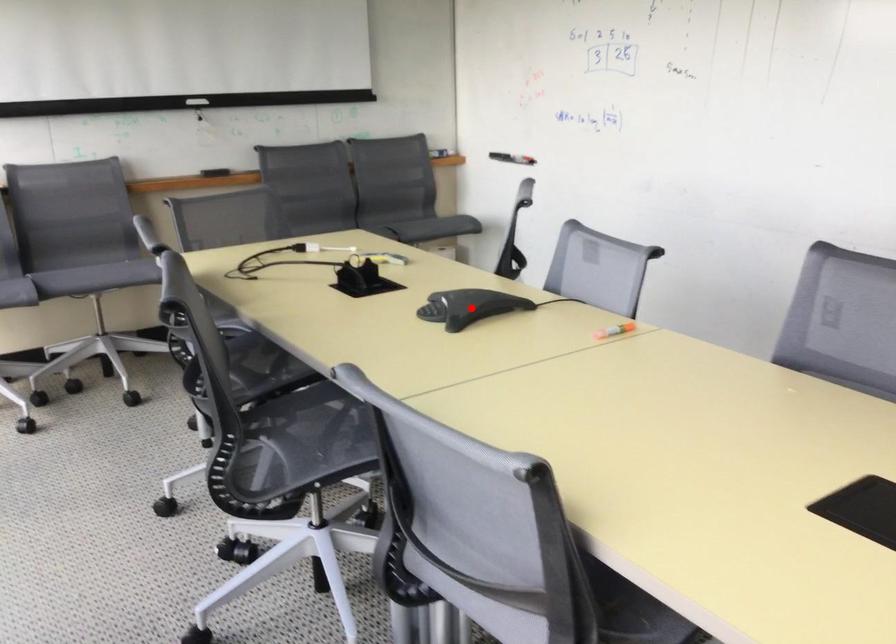
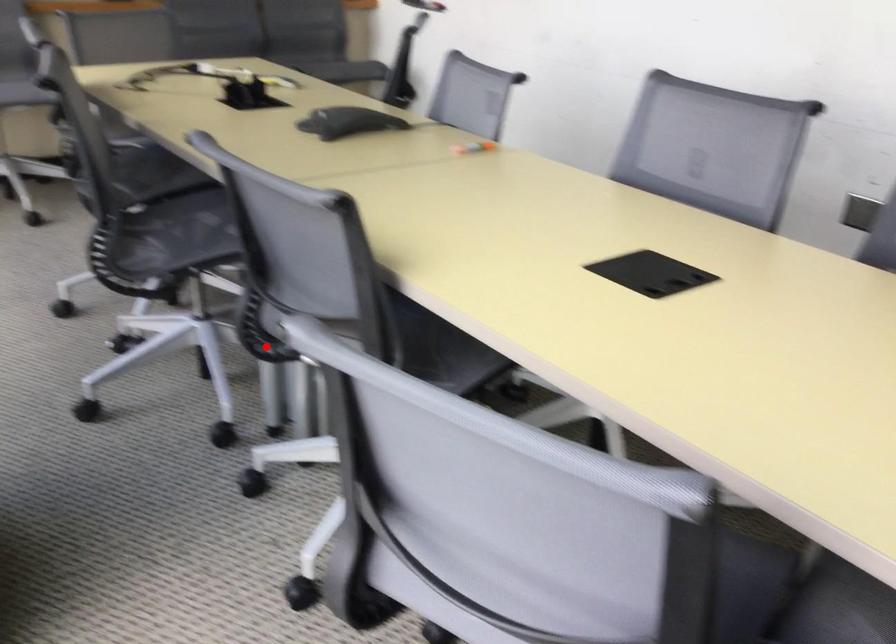
I am providing you with two images of the same scene from different viewpoints. A red point is marked on the first image and another point is marked on the second image. Does the point marked in image1 correspond to the same location as the one in image2?

No